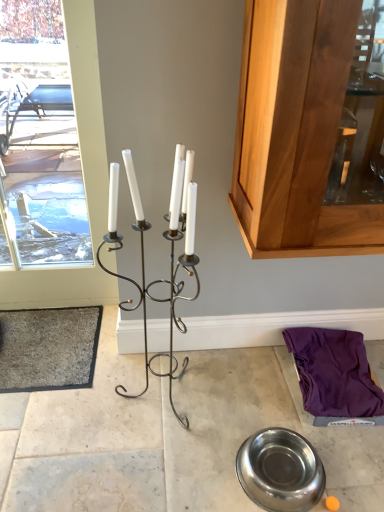
Question: Considering the positions of black wrought iron candle holder at center and gray carpet at lower left in the image, is black wrought iron candle holder at center wider or thinner than gray carpet at lower left?

Choices:
 (A) wide
 (B) thin

Answer: (B)

Question: From a real-world perspective, is black wrought iron candle holder at center above or below gray carpet at lower left?

Choices:
 (A) below
 (B) above

Answer: (B)

Question: Which object is positioned closest to the polished stainless steel bowl at lower center?

Choices:
 (A) black wrought iron candle holder at center
 (B) white glass window at left
 (C) metallic silver bowl at lower center
 (D) gray carpet at lower left

Answer: (C)

Question: Which object is positioned farthest from the black wrought iron candle holder at center?

Choices:
 (A) white glass window at left
 (B) metallic silver bowl at lower center
 (C) gray carpet at lower left
 (D) polished stainless steel bowl at lower center

Answer: (A)